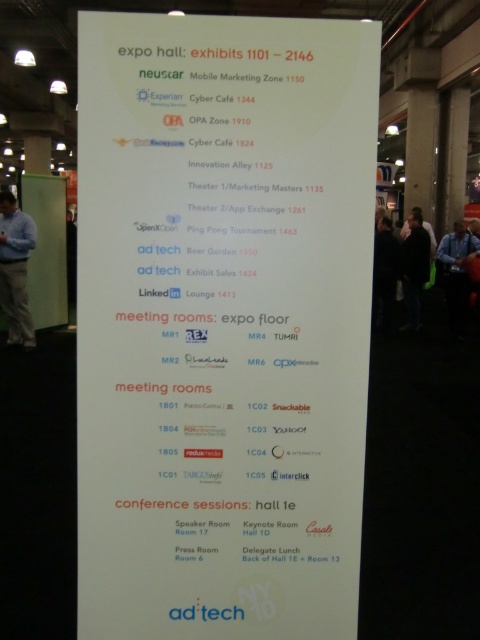
You are standing in front of the white paper sign at center and the blue shirt at left. Which object is shorter?

A: The white paper sign at center is shorter than the blue shirt at left.

You are standing in front of the expo hall signboard and see the white paper sign at center and the blue shirt at left. Which object is located to the right of the other?

The white paper sign at center is positioned on the right side of blue shirt at left.

You are at the ad tech expo and need to move from point A to point B. Point A is at coordinates point (x=302, y=179) and point B is at point (x=23, y=340). According to the signboard, which direction should you go to reach point B from point A?

To reach point B at (x=23, y=340) from point A at (x=302, y=179), you should move downward and to the right since point B is positioned below and to the right of point A.